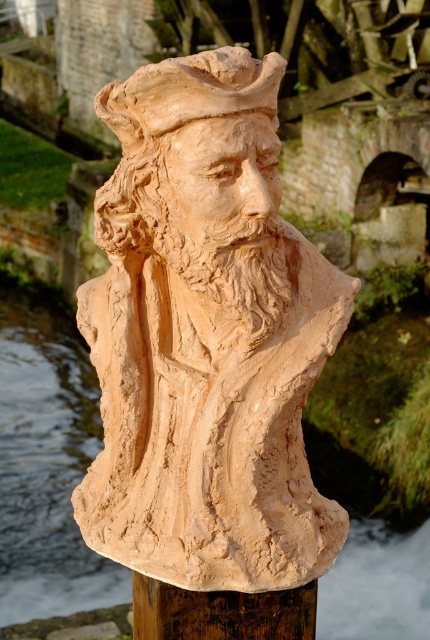
You are an art student visiting a sculpture garden. You see the terracotta statue at center and the matte clay bust at center. Which one is taller?

The terracotta statue at center is much taller than the matte clay bust at center.

You are standing in front of a terracotta bust sculpture of a bearded man mounted on a wooden post. There is a point marked at coordinates (205, 337). Based on the scene, where is this point located?

The point at coordinates (205, 337) is on the terracotta statue at center.

You are standing in front of the terracotta bust sculpture mounted on the wooden post. There are two points marked on the sculpture, one at coordinates point (x=175, y=122) and the other at point (x=178, y=616). Which point is nearer to you?

Point (x=175, y=122) is closer to the viewer than point (x=178, y=616).